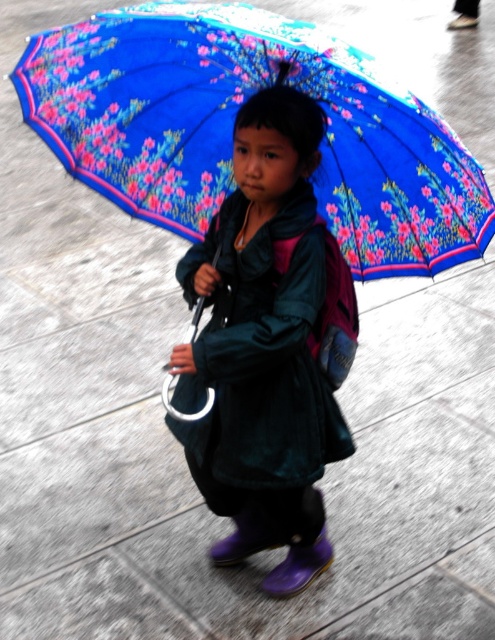
Question: Which point appears farthest from the camera in this image?

Choices:
 (A) (269, 259)
 (B) (276, 29)

Answer: (A)

Question: Does blue floral-patterned umbrella at upper center appear on the right side of velvet green coat at center?

Choices:
 (A) yes
 (B) no

Answer: (A)

Question: Which object is farther from the camera taking this photo?

Choices:
 (A) velvet green coat at center
 (B) blue floral-patterned umbrella at upper center

Answer: (A)

Question: Does blue floral-patterned umbrella at upper center come behind velvet green coat at center?

Choices:
 (A) yes
 (B) no

Answer: (B)

Question: Can you confirm if blue floral-patterned umbrella at upper center is smaller than velvet green coat at center?

Choices:
 (A) yes
 (B) no

Answer: (B)